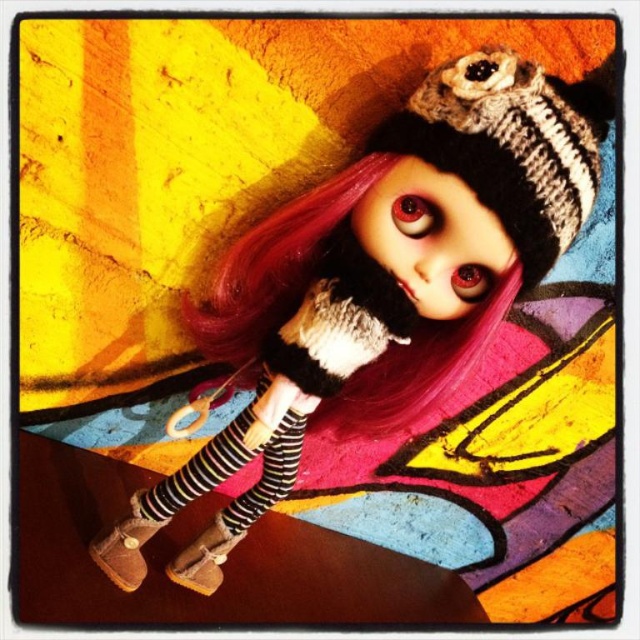
Which of these two, suede boots at lower left or knitted woolen beanie at upper center, stands shorter?

knitted woolen beanie at upper center is shorter.

Is point (397, 208) less distant than point (509, 204)?

No.

Between point (268, 321) and point (564, 218), which one is positioned behind?

The point (268, 321) is more distant.

Find the location of a particular element. This screenshot has width=640, height=640. suede boots at lower left is located at coordinates (394, 266).

Between knitted woolen beanie at upper center and suede/leather boot at lower left, which one is positioned higher?

knitted woolen beanie at upper center

Consider the image. Can you confirm if knitted woolen beanie at upper center is thinner than suede/leather boot at lower left?

No.

Does point (486, 141) come behind point (128, 570)?

No, (486, 141) is in front of (128, 570).

Where is `knitted woolen beanie at upper center`? knitted woolen beanie at upper center is located at coordinates (509, 145).

Measure the distance between point (548, 202) and camera.

The distance of point (548, 202) from camera is 1.01 meters.

Is suede boots at lower left shorter than brown suede boot at lower left?

Incorrect, suede boots at lower left's height does not fall short of brown suede boot at lower left's.

Which is in front, point (493, 90) or point (188, 563)?

Point (493, 90) is in front.

This screenshot has width=640, height=640. What are the coordinates of `suede boots at lower left` in the screenshot? It's located at (394, 266).